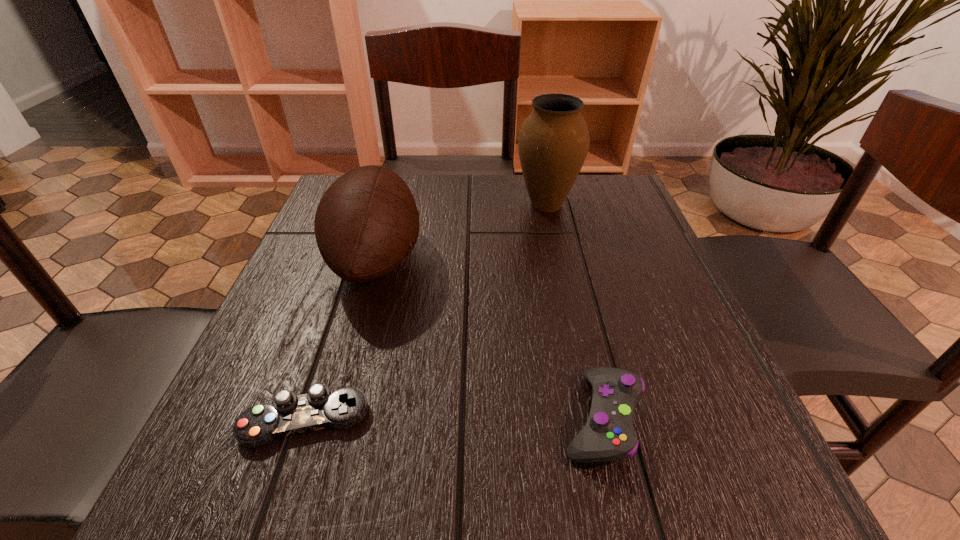
The height and width of the screenshot is (540, 960). I want to click on unoccupied area between the tallest object and the shortest object, so click(x=426, y=313).

Identify the location of free space between the third shortest object and the tallest object. The image size is (960, 540). (462, 232).

This screenshot has width=960, height=540. Find the location of `unoccupied area between the third tallest object and the shorter control`. unoccupied area between the third tallest object and the shorter control is located at coordinates (453, 419).

Locate an element on the screen. vacant point located between the second shortest object and the tallest object is located at coordinates (574, 311).

Image resolution: width=960 pixels, height=540 pixels. I want to click on free space between the football and the shorter control, so click(341, 340).

Image resolution: width=960 pixels, height=540 pixels. Identify the location of free space between the urn and the third shortest object. (462, 232).

Locate an element on the screen. Image resolution: width=960 pixels, height=540 pixels. the second closest object relative to the shortest object is located at coordinates (609, 435).

The width and height of the screenshot is (960, 540). I want to click on object that is the third closest to the left control, so click(x=553, y=142).

Locate an element on the screen. This screenshot has width=960, height=540. free space that satisfies the following two spatial constraints: 1. on the laces of the right control; 2. on the left side of the football is located at coordinates click(x=332, y=418).

Image resolution: width=960 pixels, height=540 pixels. Find the location of `blank area in the image that satisfies the following two spatial constraints: 1. on the back side of the second shortest object; 2. on the left side of the shortest object`. blank area in the image that satisfies the following two spatial constraints: 1. on the back side of the second shortest object; 2. on the left side of the shortest object is located at coordinates (306, 418).